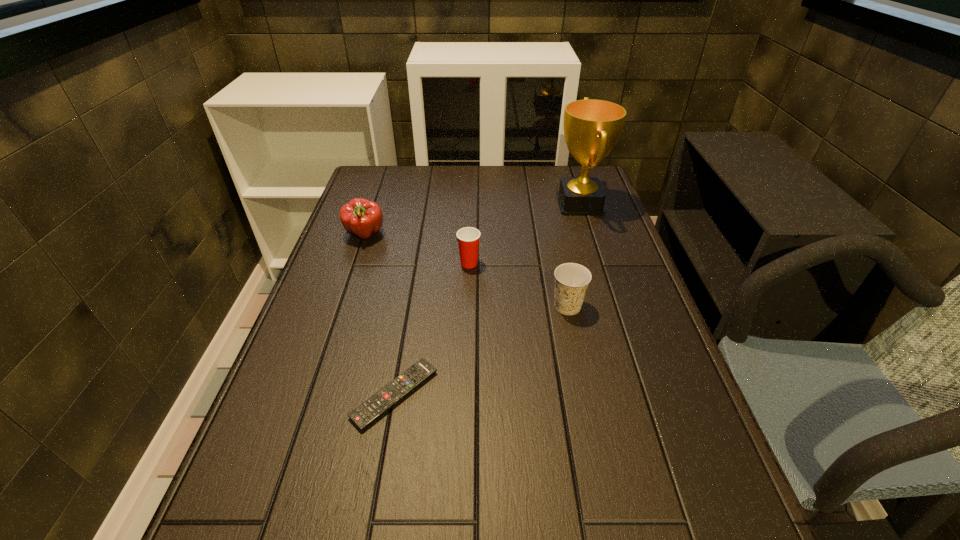
At what (x,y) coordinates should I click in order to perform the action: click on free space between the leftmost object and the right Dixie cup. Please return your answer as a coordinate pair (x, y). The image size is (960, 540). Looking at the image, I should click on (467, 271).

The image size is (960, 540). What are the coordinates of `unoccupied position between the third nearest object and the tallest object` in the screenshot? It's located at (524, 234).

The height and width of the screenshot is (540, 960). Identify the location of vacant space that's between the nearest object and the nearer Dixie cup. (481, 350).

Locate an element on the screen. The image size is (960, 540). object identified as the third closest to the tallest object is located at coordinates (360, 217).

This screenshot has height=540, width=960. What are the coordinates of `the second closest object to the farther Dixie cup` in the screenshot? It's located at (360, 217).

This screenshot has height=540, width=960. Find the location of `vacant space that satisfies the following two spatial constraints: 1. on the front side of the fourth farthest object; 2. on the right side of the farther Dixie cup`. vacant space that satisfies the following two spatial constraints: 1. on the front side of the fourth farthest object; 2. on the right side of the farther Dixie cup is located at coordinates (468, 306).

This screenshot has width=960, height=540. I want to click on free region that satisfies the following two spatial constraints: 1. on the front-facing side of the tallest object; 2. on the front side of the leftmost object, so click(589, 235).

Locate an element on the screen. vacant area in the image that satisfies the following two spatial constraints: 1. on the front-facing side of the tallest object; 2. on the front side of the right Dixie cup is located at coordinates (612, 306).

Find the location of a particular element. free location that satisfies the following two spatial constraints: 1. on the front side of the left Dixie cup; 2. on the right side of the second nearest object is located at coordinates (468, 306).